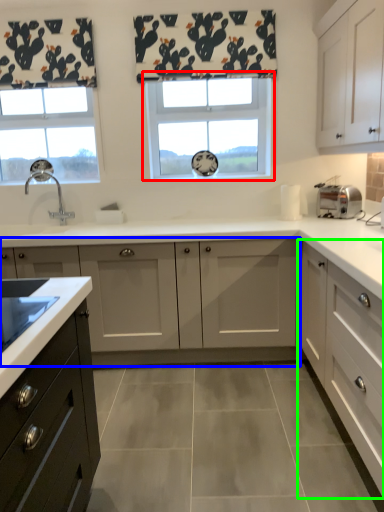
Question: Which is nearer to the window (highlighted by a red box)? cabinetry (highlighted by a blue box) or cabinetry (highlighted by a green box).

Choices:
 (A) cabinetry
 (B) cabinetry

Answer: (A)